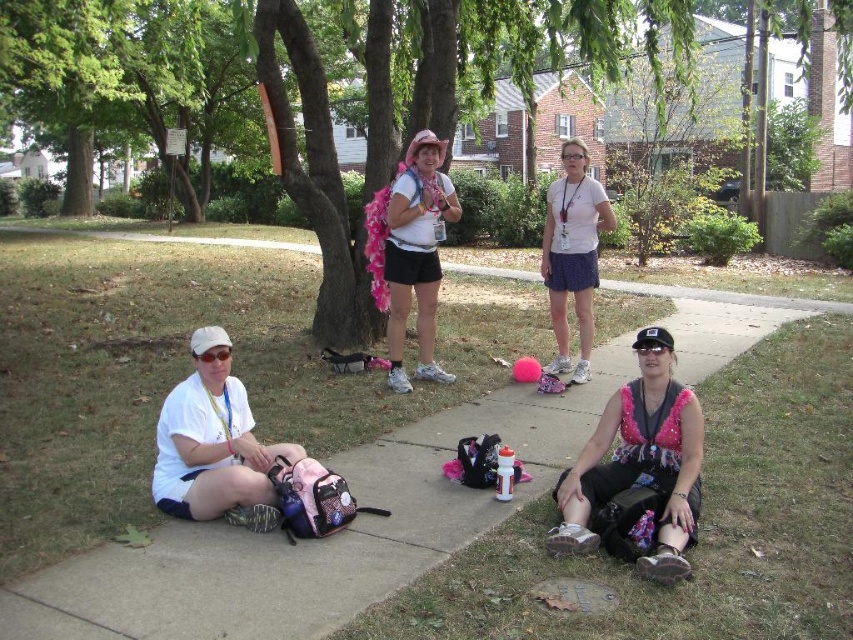
Question: Is pink sequined top at lower right smaller than white cotton shirt at center?

Choices:
 (A) no
 (B) yes

Answer: (B)

Question: Which object is the farthest from the concrete sidewalk at center?

Choices:
 (A) white cotton shirt at center
 (B) pink sequined top at lower right
 (C) green grass at lower right
 (D) green leafy tree at center

Answer: (D)

Question: Can you confirm if concrete sidewalk at center is smaller than green leafy tree at center?

Choices:
 (A) no
 (B) yes

Answer: (B)

Question: Which point appears farthest from the camera in this image?

Choices:
 (A) (373, 36)
 (B) (102, 586)
 (C) (419, 280)
 (D) (666, 371)

Answer: (A)

Question: Estimate the real-world distances between objects in this image. Which object is farther from the green grass at lower right?

Choices:
 (A) white cotton shirt at center
 (B) pink sequined top at lower right

Answer: (A)

Question: Does green leafy tree at center have a larger size compared to pink sequined top at lower right?

Choices:
 (A) yes
 (B) no

Answer: (A)